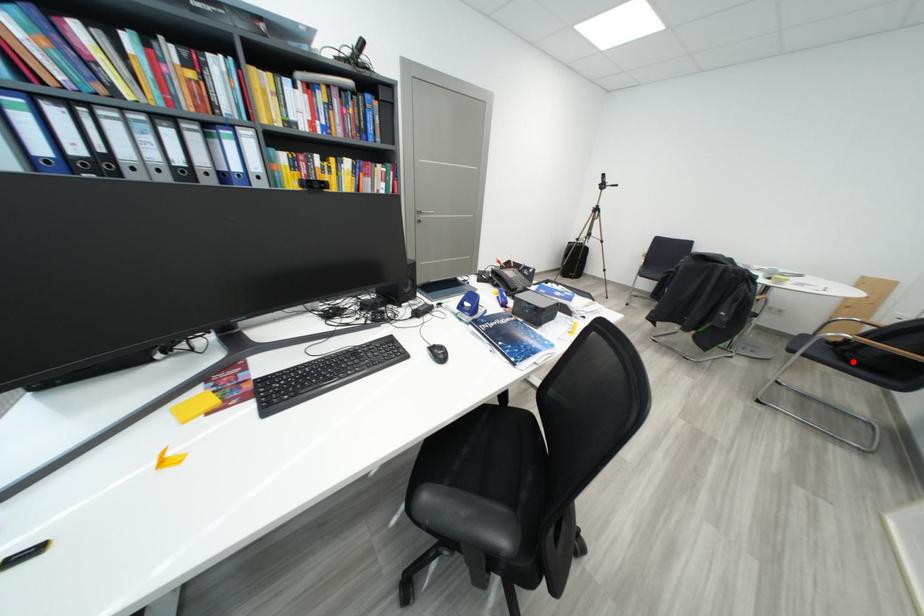
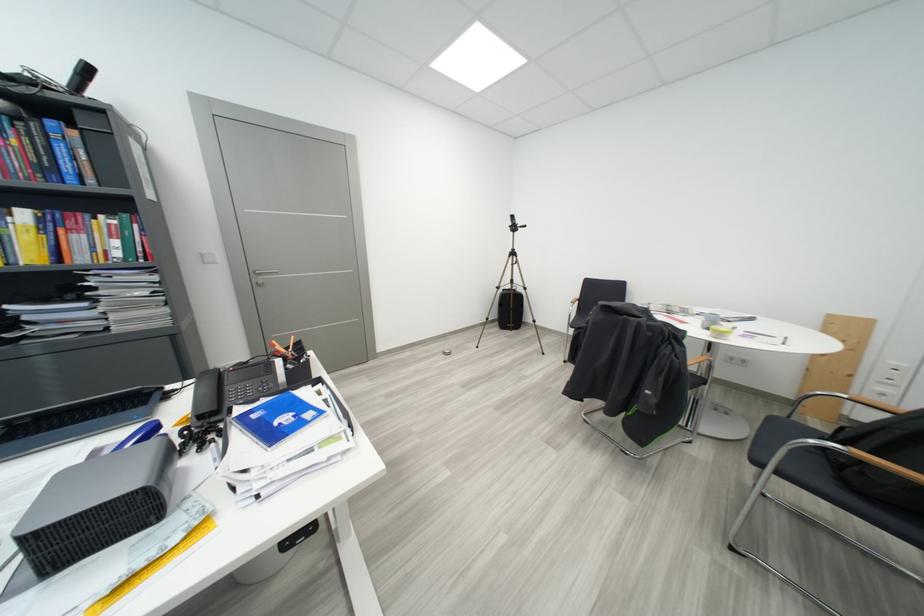
Question: I am providing you with two images of the same scene from different viewpoints. A red point is shown in image1. For the corresponding object point in image2, is it positioned nearer or farther from the camera?

Choices:
 (A) Nearer
 (B) Farther

Answer: (A)